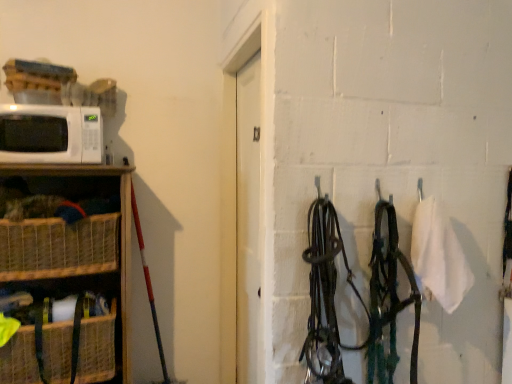
Question: Considering the relative positions of white matte microwave at left and woven brown basket at lower left, the 2th basket viewed from the top, in the image provided, is white matte microwave at left in front of woven brown basket at lower left, the 2th basket viewed from the top,?

Choices:
 (A) yes
 (B) no

Answer: (B)

Question: Can you confirm if white matte microwave at left is smaller than woven brown basket at lower left, the 1th basket from the bottom?

Choices:
 (A) yes
 (B) no

Answer: (A)

Question: Is white matte microwave at left positioned far away from woven brown basket at lower left, the 2th basket viewed from the top?

Choices:
 (A) yes
 (B) no

Answer: (B)

Question: Is white matte microwave at left not within woven brown basket at lower left, the 1th basket from the bottom?

Choices:
 (A) no
 (B) yes

Answer: (B)

Question: From the image's perspective, is white matte microwave at left over woven brown basket at lower left, the 2th basket viewed from the top?

Choices:
 (A) yes
 (B) no

Answer: (A)

Question: Does point (124, 288) appear closer or farther from the camera than point (109, 216)?

Choices:
 (A) closer
 (B) farther

Answer: (B)

Question: In terms of width, does woven wood shelf at left look wider or thinner when compared to woven brown basket at left, which appears as the first basket when viewed from the top?

Choices:
 (A) wide
 (B) thin

Answer: (A)

Question: Is woven wood shelf at left spatially inside woven brown basket at left, which appears as the first basket when viewed from the top, or outside of it?

Choices:
 (A) outside
 (B) inside

Answer: (A)

Question: From the image's perspective, is woven wood shelf at left above or below woven brown basket at left, the second basket when ordered from bottom to top?

Choices:
 (A) below
 (B) above

Answer: (A)

Question: Is white matte microwave at left wider or thinner than woven wood shelf at left?

Choices:
 (A) thin
 (B) wide

Answer: (A)

Question: Is white matte microwave at left in front of or behind woven wood shelf at left in the image?

Choices:
 (A) behind
 (B) front

Answer: (A)

Question: Considering the relative positions of white matte microwave at left and woven wood shelf at left in the image provided, is white matte microwave at left to the left or to the right of woven wood shelf at left?

Choices:
 (A) left
 (B) right

Answer: (A)

Question: From a real-world perspective, is white matte microwave at left physically located above or below woven wood shelf at left?

Choices:
 (A) above
 (B) below

Answer: (A)

Question: Would you say woven brown basket at lower left, the 1th basket from the bottom, is to the left or to the right of woven wood shelf at left in the picture?

Choices:
 (A) left
 (B) right

Answer: (A)

Question: Looking at the image, does woven brown basket at lower left, the 2th basket viewed from the top, seem bigger or smaller compared to woven wood shelf at left?

Choices:
 (A) big
 (B) small

Answer: (B)